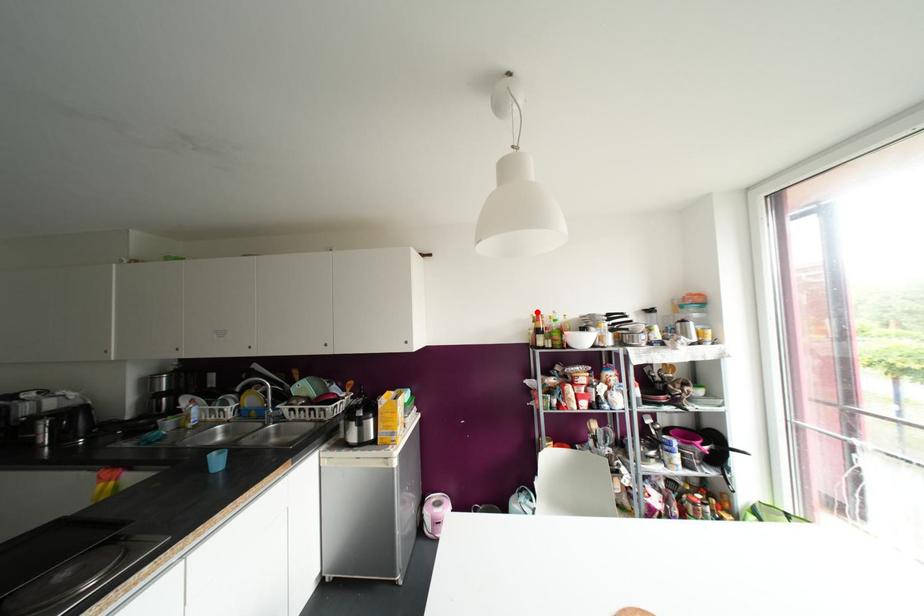
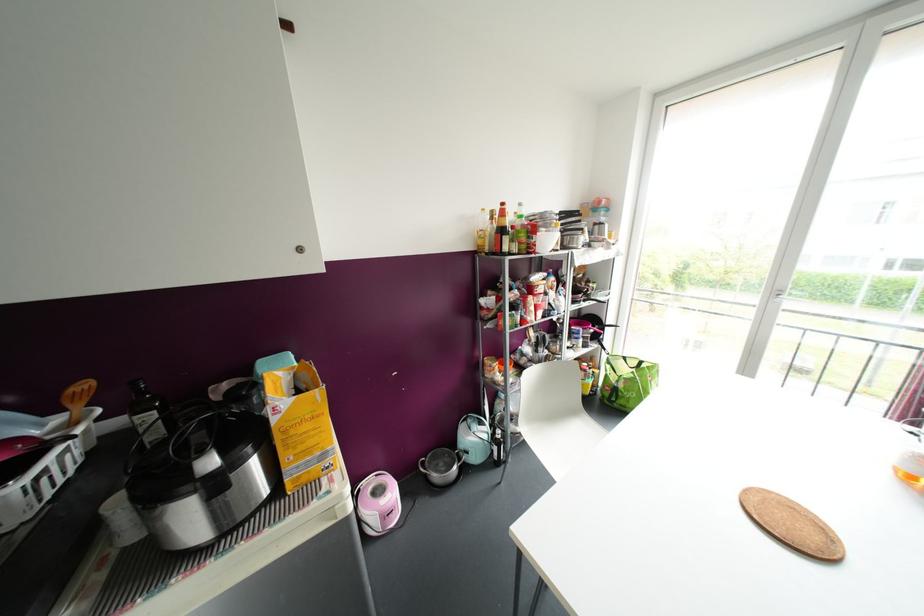
The point at the highlighted location is marked in the first image. Where is the corresponding point in the second image?

(502, 204)